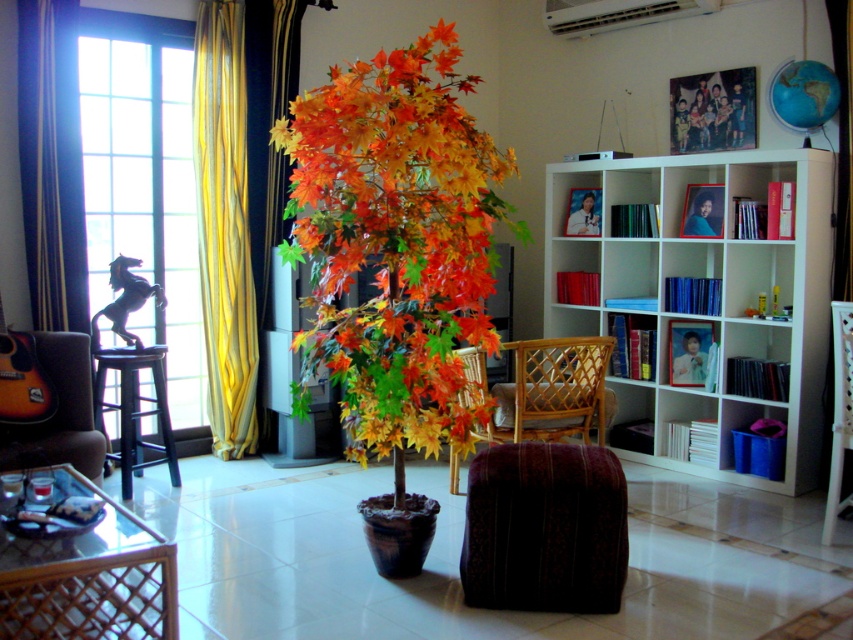
From the picture: You are sitting in the brown leather armchair at left and want to reach the yellow striped fabric at left to adjust its position. Can you easily reach it from your current position?

The brown leather armchair at left is behind the yellow striped fabric at left, so you cannot easily reach it from your current position.

You are standing in the living room and want to reach the point marked as point (212, 177). If you can walk 5 meters in a straight line, will you be able to reach that point from where you are currently standing?

The distance between point (212, 177) and the camera is 4.40 meters. Since you can walk 5 meters in a straight line, you will be able to reach the point as the distance is within your walking range.